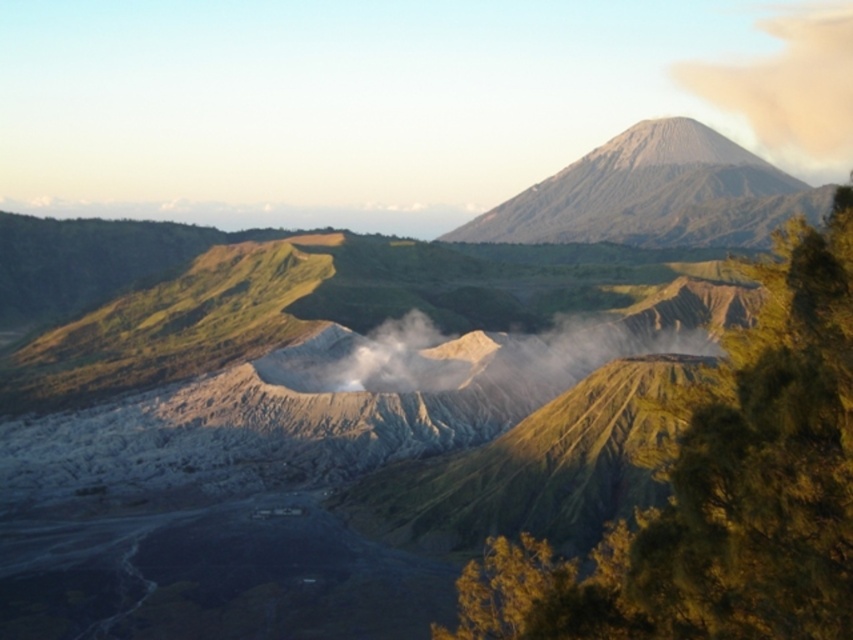
Question: Can you confirm if green leafy tree at upper right is smaller than white dusty cloud at upper right?

Choices:
 (A) yes
 (B) no

Answer: (A)

Question: Which is farther from the white smoke at center?

Choices:
 (A) white dusty cloud at upper right
 (B) green leafy tree at upper right
 (C) gray/smooth mountain at upper right

Answer: (A)

Question: Is green leafy tree at upper right smaller than gray/smooth mountain at upper right?

Choices:
 (A) no
 (B) yes

Answer: (B)

Question: Among these points, which one is farthest from the camera?

Choices:
 (A) (x=700, y=214)
 (B) (x=451, y=340)

Answer: (A)

Question: Estimate the real-world distances between objects in this image. Which object is closer to the white dusty cloud at upper right?

Choices:
 (A) gray/smooth mountain at upper right
 (B) green leafy tree at upper right
 (C) white smoke at center

Answer: (A)

Question: From the image, what is the correct spatial relationship of green leafy tree at upper right in relation to white dusty cloud at upper right?

Choices:
 (A) above
 (B) below

Answer: (B)